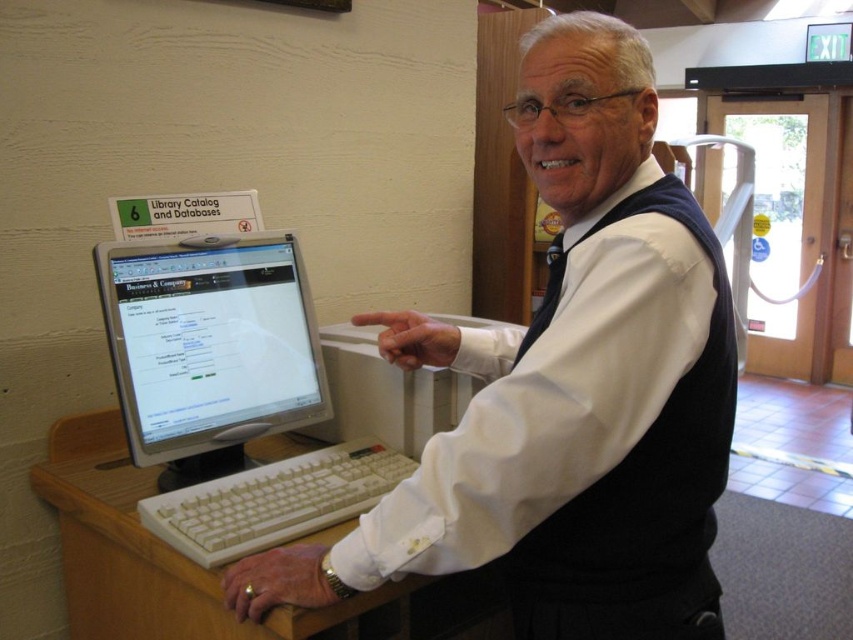
You are a photographer taking a closeup shot of the white matte shirt at center and the white plastic keyboard at lower center. Which object will appear bigger in your photo?

The white matte shirt at center will appear bigger in the photo since it is larger in size than the white plastic keyboard at lower center.

You are trying to locate the white matte shirt at center in the image. According to the scene description, where would you find it?

The white matte shirt at center is located at point (x=567, y=388).

You are a photographer taking a closeup shot of the scene. You need to focus on both the white matte shirt at center and the white glossy monitor at center. Which object should you adjust your focus on first if you want to ensure both are in focus, considering their sizes?

The white matte shirt at center is larger in size than the white glossy monitor at center, so you should focus on the larger object first to ensure both are in focus.